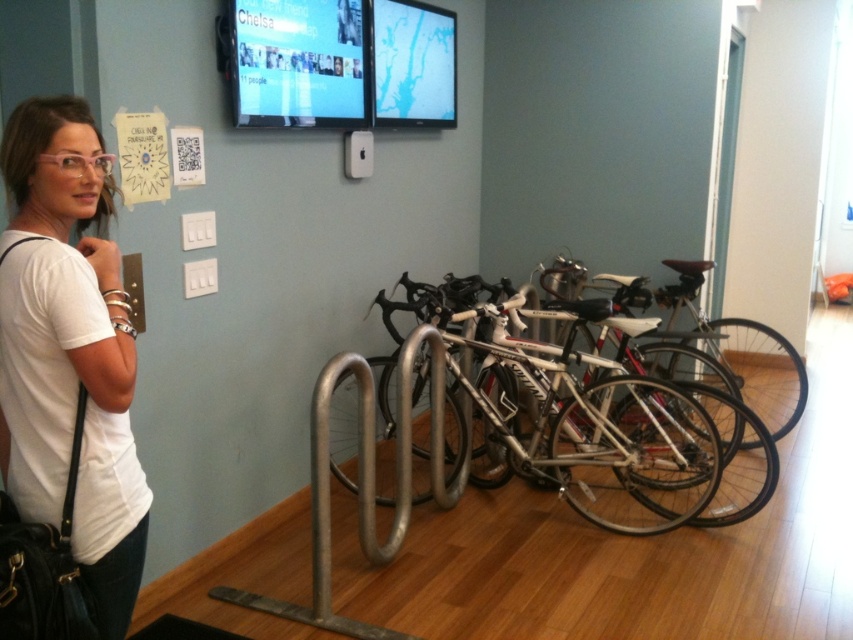
Does silver metallic bicycle at center have a lesser width compared to white matte t-shirt at left?

No, silver metallic bicycle at center is not thinner than white matte t-shirt at left.

You are a GUI agent. You are given a task and a screenshot of the screen. Output one action in this format:
    pyautogui.click(x=<x>, y=<y>)
    Task: Click on the silver metallic bicycle at center
    The width and height of the screenshot is (853, 640).
    Given the screenshot: What is the action you would take?
    pyautogui.click(x=624, y=408)

Based on the photo, who is more distant from viewer, (616, 374) or (76, 531)?

The point (616, 374) is more distant.

Identify the location of silver metallic bicycle at center. This screenshot has width=853, height=640. (624, 408).